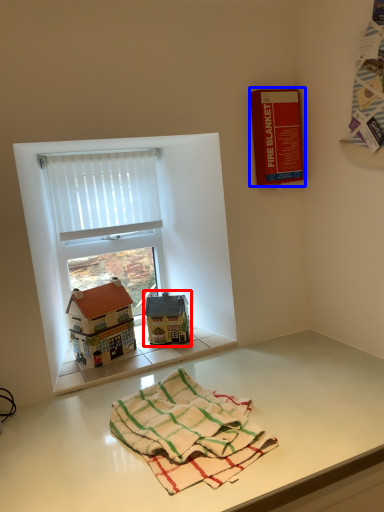
Question: Which object is closer to the camera taking this photo, toy (highlighted by a red box) or book cover (highlighted by a blue box)?

Choices:
 (A) toy
 (B) book cover

Answer: (B)